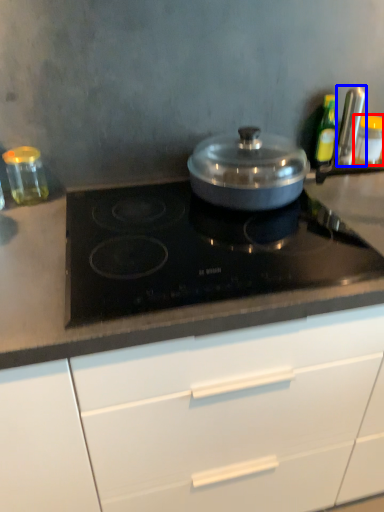
Question: Which of the following is the closest to the observer, kitchen appliance (highlighted by a red box) or kitchen appliance (highlighted by a blue box)?

Choices:
 (A) kitchen appliance
 (B) kitchen appliance

Answer: (B)